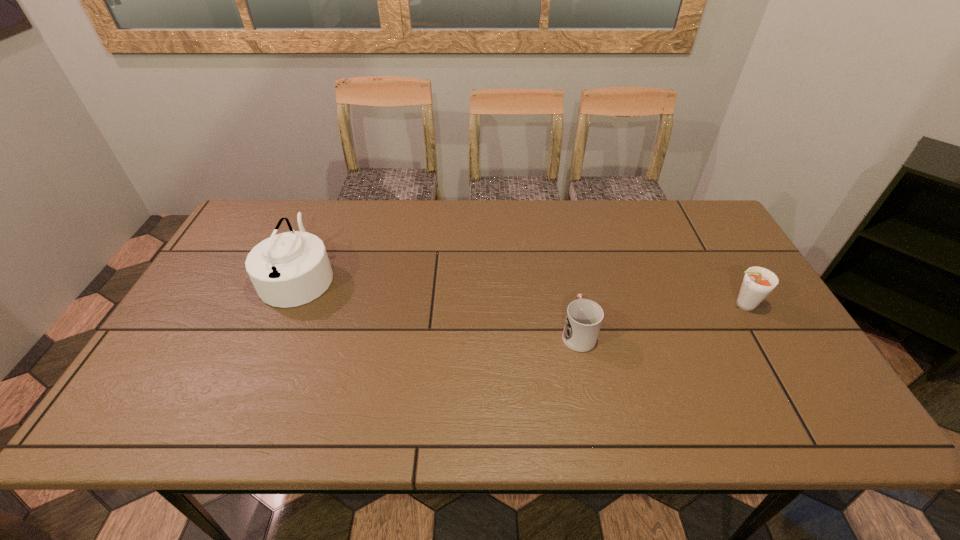
Identify the location of empty space that is in between the second tallest object and the second object from right to left. (660, 319).

Locate which object is the second closest to the cup. Please provide its 2D coordinates. Your answer should be formatted as a tuple, i.e. [(x, y)], where the tuple contains the x and y coordinates of a point satisfying the conditions above.

[(290, 269)]

Select which object appears as the closest to the shortest object. Please provide its 2D coordinates. Your answer should be formatted as a tuple, i.e. [(x, y)], where the tuple contains the x and y coordinates of a point satisfying the conditions above.

[(758, 282)]

The image size is (960, 540). I want to click on free space in the image that satisfies the following two spatial constraints: 1. on the spout of the tallest object; 2. on the side of the shortest object where the handle is located, so click(275, 332).

The height and width of the screenshot is (540, 960). What are the coordinates of `vacant area in the image that satisfies the following two spatial constraints: 1. on the spout of the tallest object; 2. on the side of the cup where the handle is located` in the screenshot? It's located at (275, 332).

I want to click on vacant space that satisfies the following two spatial constraints: 1. on the side of the second object from right to left where the handle is located; 2. on the spout of the kettle, so click(566, 275).

The height and width of the screenshot is (540, 960). In order to click on vacant area in the image that satisfies the following two spatial constraints: 1. on the spout of the kettle; 2. on the side of the second object from left to right where the handle is located in this screenshot , I will do `click(275, 332)`.